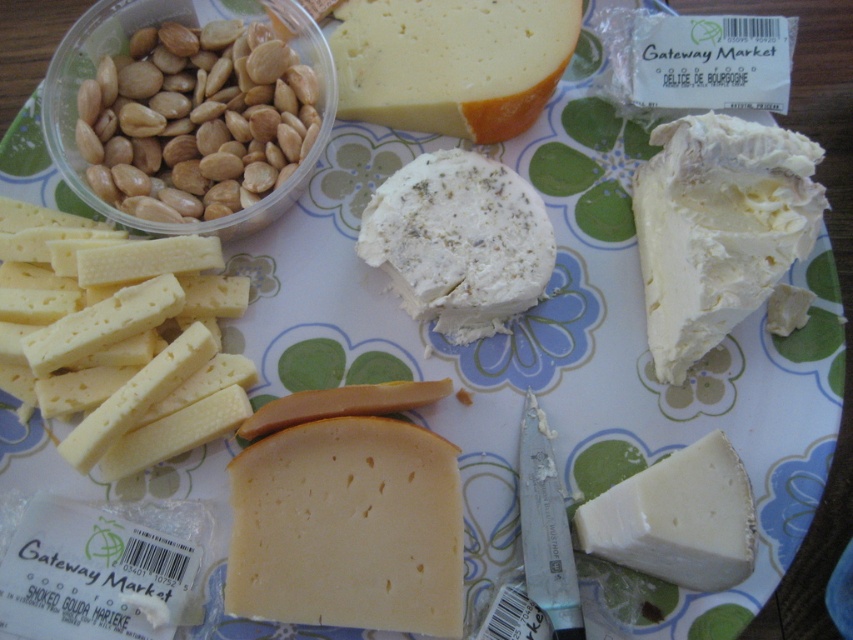
Which is above, white crumbly cream cheese at center or white creamy cheese at lower right?

Positioned higher is white crumbly cream cheese at center.

Which of these two, white crumbly cream cheese at center or white creamy cheese at lower right, stands taller?

white crumbly cream cheese at center

Is point (413, 196) closer to viewer compared to point (674, 540)?

No, it is behind (674, 540).

At what (x,y) coordinates should I click in order to perform the action: click on white crumbly cream cheese at center. Please return your answer as a coordinate pair (x, y). This screenshot has width=853, height=640. Looking at the image, I should click on (459, 241).

Looking at this image, which is below, yellow crumbly cheese at lower left or brown matte almonds at left?

Positioned lower is yellow crumbly cheese at lower left.

Is yellow crumbly cheese at lower left positioned behind brown matte almonds at left?

That is False.

Based on the photo, who is more forward, (152,385) or (285,86)?

Point (152,385)

Locate an element on the screen. yellow crumbly cheese at lower left is located at coordinates (131, 349).

In the scene shown: Is yellowish smooth cheese at center wider than white creamy cheese at upper right?

Correct, the width of yellowish smooth cheese at center exceeds that of white creamy cheese at upper right.

The height and width of the screenshot is (640, 853). What do you see at coordinates (347, 528) in the screenshot? I see `yellowish smooth cheese at center` at bounding box center [347, 528].

Where is `yellowish smooth cheese at center`? yellowish smooth cheese at center is located at coordinates (347, 528).